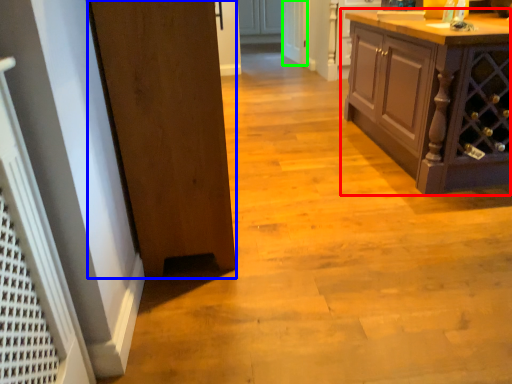
Question: Estimate the real-world distances between objects in this image. Which object is farther from cabinetry (highlighted by a red box), door (highlighted by a blue box) or screen door (highlighted by a green box)?

Choices:
 (A) door
 (B) screen door

Answer: (B)